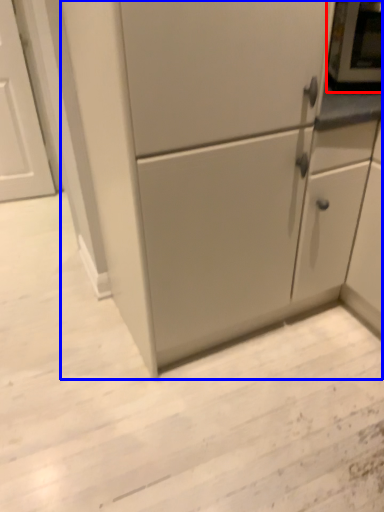
Question: Among these objects, which one is nearest to the camera, appliance (highlighted by a red box) or cabinetry (highlighted by a blue box)?

Choices:
 (A) appliance
 (B) cabinetry

Answer: (B)